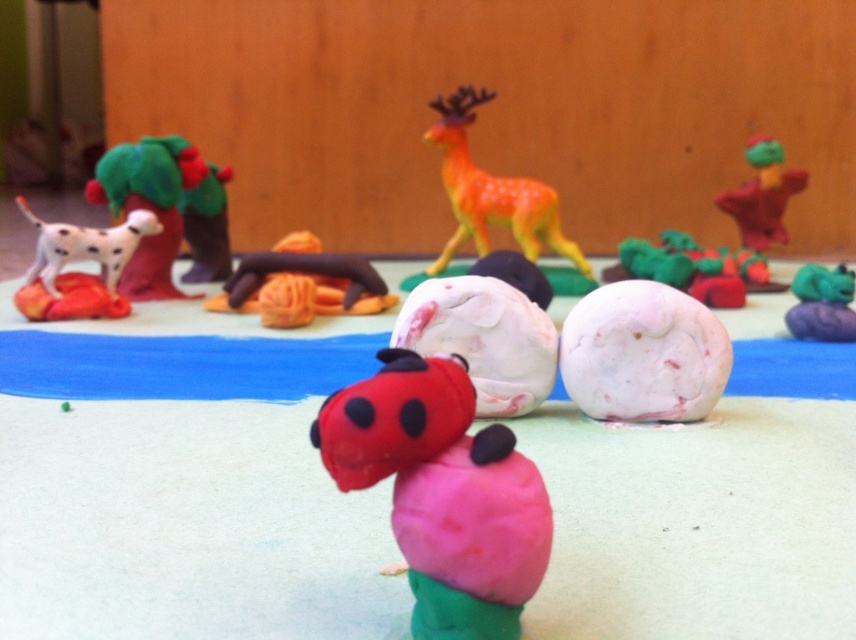
Question: Does white marbled rock at center appear on the right side of green fuzzy figure at upper right?

Choices:
 (A) no
 (B) yes

Answer: (A)

Question: Which object is positioned closest to the matte green tree at left?

Choices:
 (A) white marble ball at center
 (B) green clay rock at lower right
 (C) brown clay bear at center
 (D) green fuzzy figure at upper right

Answer: (C)

Question: Which is farther from the white matte dog at left?

Choices:
 (A) green clay rock at lower right
 (B) white marbled rock at center
 (C) brown clay bear at center

Answer: (A)

Question: Can you confirm if white marble ball at center is positioned above matte green tree at left?

Choices:
 (A) no
 (B) yes

Answer: (A)

Question: Is rubber duck at center to the right of matte green tree at left from the viewer's perspective?

Choices:
 (A) yes
 (B) no

Answer: (A)

Question: Which object is the farthest from the orange matte deer at center?

Choices:
 (A) matte green tree at left
 (B) white marble ball at center
 (C) green clay rock at lower right

Answer: (B)